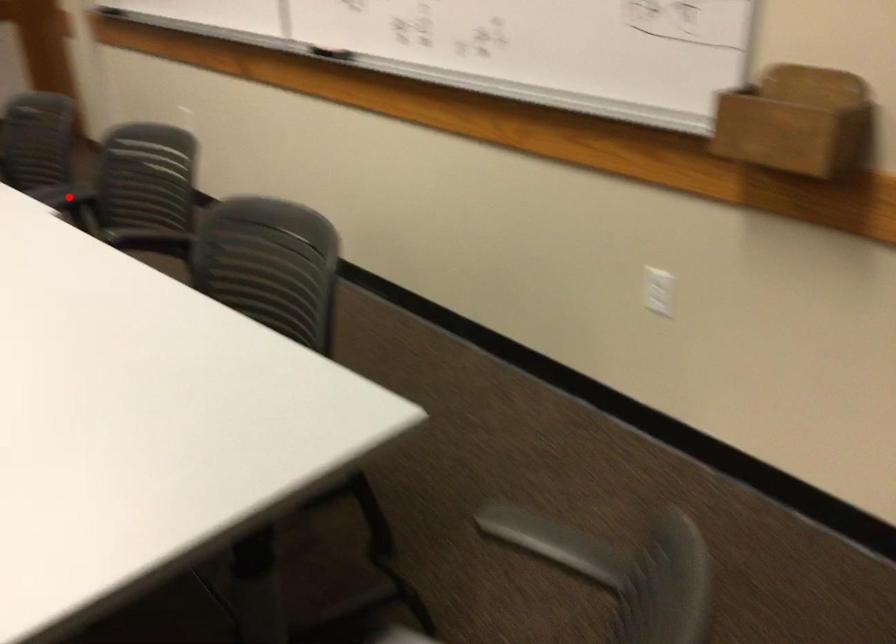
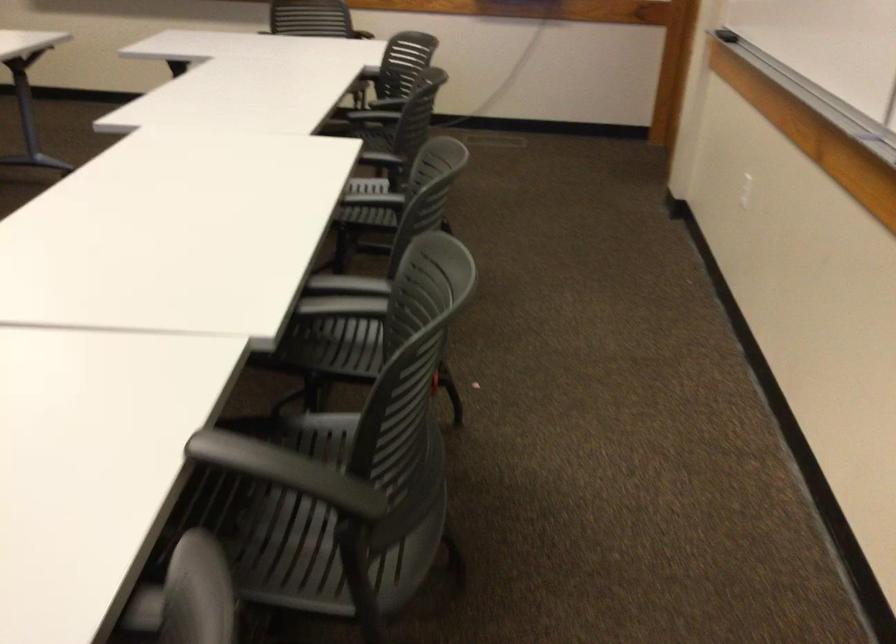
In the second image, find the point that corresponds to the highlighted location in the first image.

(343, 297)